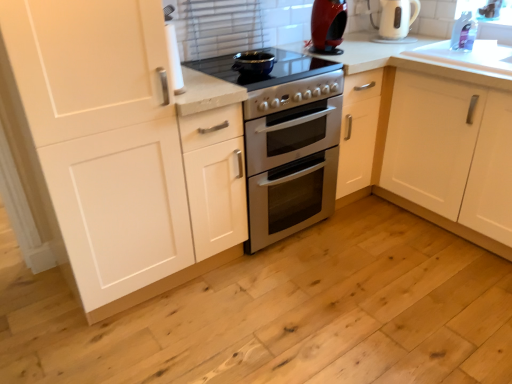
Where is `free spot to the right of white glossy electric kettle at upper right`? free spot to the right of white glossy electric kettle at upper right is located at coordinates (432, 39).